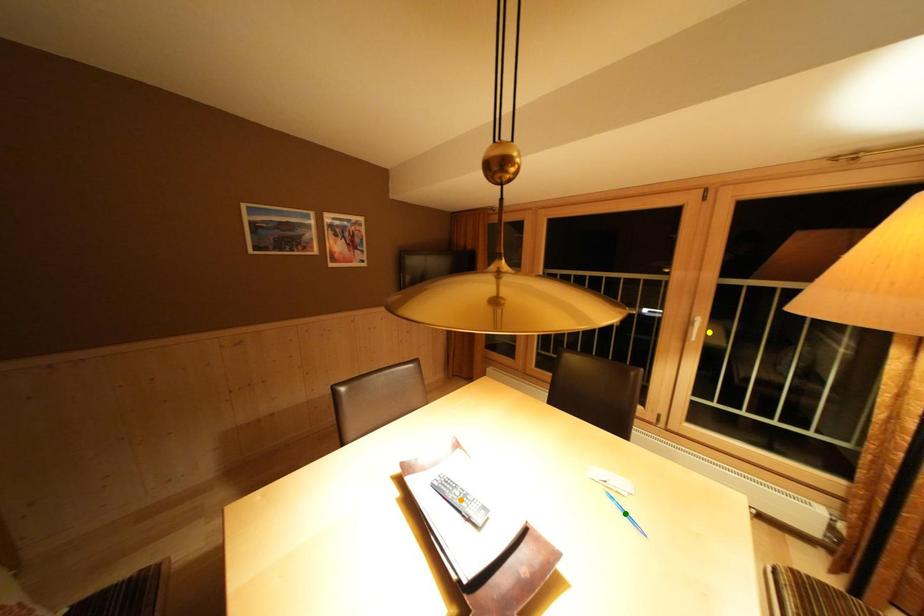
Order these from nearest to farthest:
1. yellow point
2. green point
3. orange point

green point, orange point, yellow point